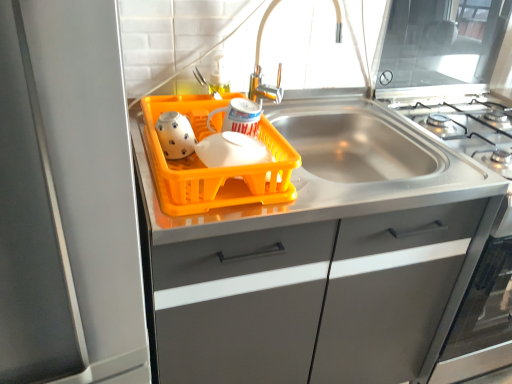
Question: In the image, is white glossy tea pot at left, the 1th tea pot in the left-to-right sequence, positioned in front of or behind orange plastic basket at center?

Choices:
 (A) front
 (B) behind

Answer: (B)

Question: From the image's perspective, is white glossy tea pot at left, the 1th tea pot in the left-to-right sequence, located above or below orange plastic basket at center?

Choices:
 (A) above
 (B) below

Answer: (A)

Question: Which is nearer to the white glossy tea pot at center, the second tea pot in the left-to-right sequence?

Choices:
 (A) satin silver refrigerator at left
 (B) matte gray cabinet at center
 (C) orange plastic basket at center
 (D) metallic silver faucet at upper center
 (E) white glossy tea pot at left, the 1th tea pot in the left-to-right sequence

Answer: (C)

Question: Considering the real-world distances, which object is closest to the satin silver refrigerator at left?

Choices:
 (A) white glossy tea pot at center, the second tea pot in the left-to-right sequence
 (B) orange plastic basket at center
 (C) white glossy tea pot at left, which is counted as the second tea pot, starting from the right
 (D) metallic silver faucet at upper center
 (E) matte gray cabinet at center

Answer: (B)